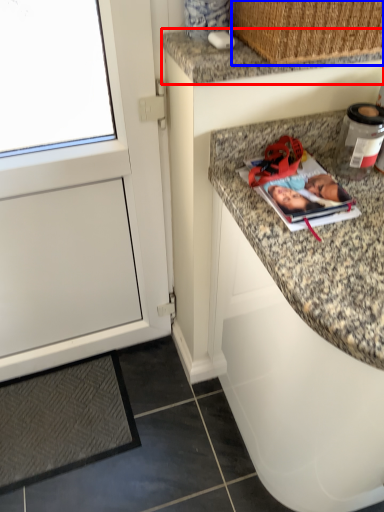
Question: Among these objects, which one is farthest to the camera, countertop (highlighted by a red box) or basket (highlighted by a blue box)?

Choices:
 (A) countertop
 (B) basket

Answer: (A)